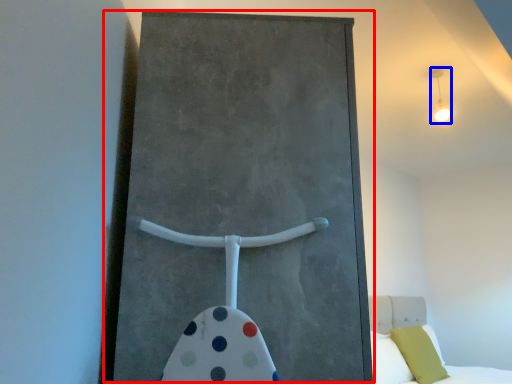
Question: Which object is closer to the camera taking this photo, barn door (highlighted by a red box) or light fixture (highlighted by a blue box)?

Choices:
 (A) barn door
 (B) light fixture

Answer: (A)